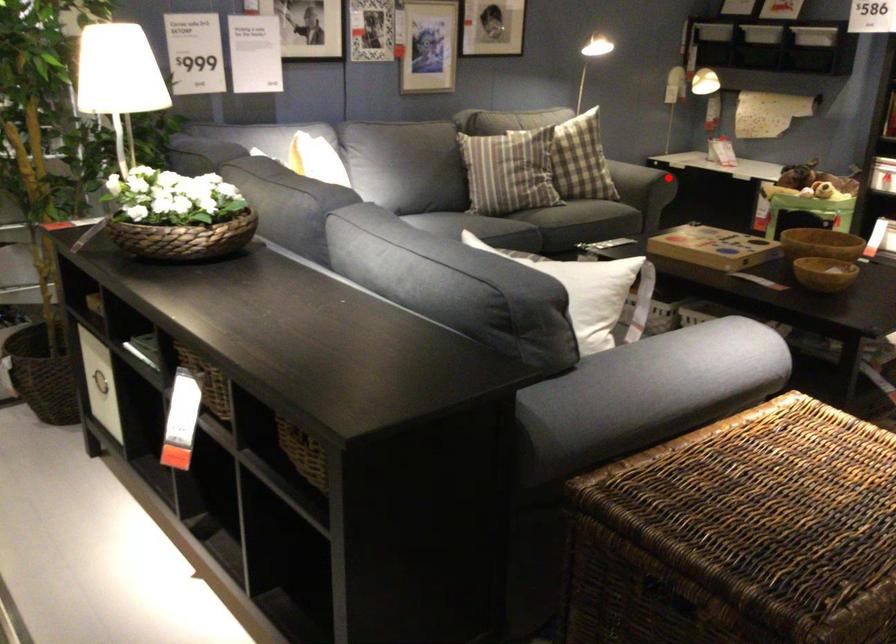
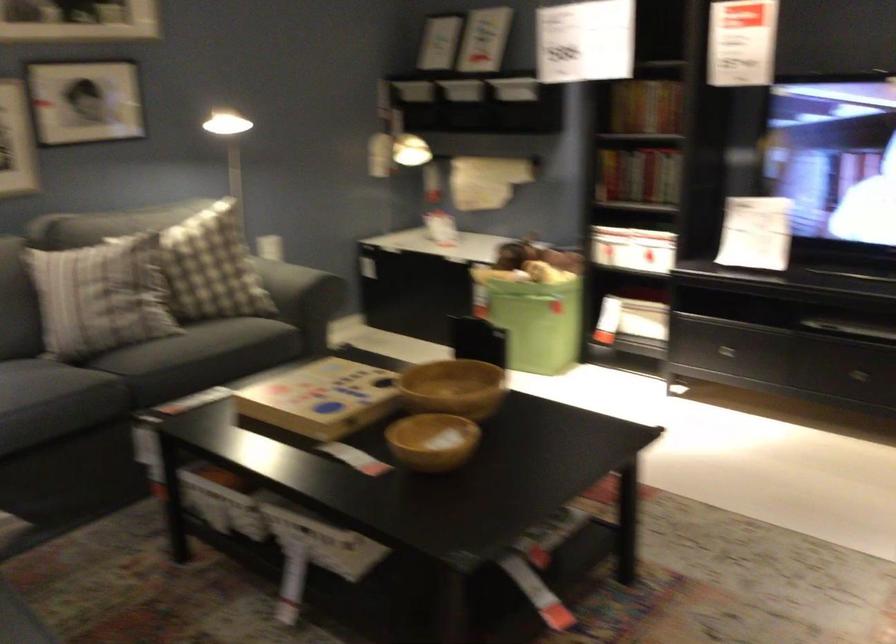
In the second image, find the point that corresponds to the highlighted location in the first image.

(286, 285)